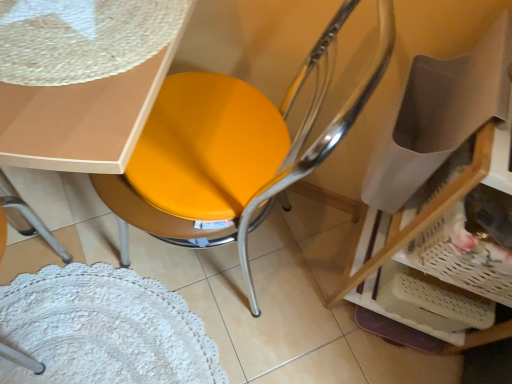
Question: Considering the relative positions of matte yellow seat at center and matte white table at upper left in the image provided, is matte yellow seat at center to the right of matte white table at upper left from the viewer's perspective?

Choices:
 (A) no
 (B) yes

Answer: (B)

Question: Is matte yellow seat at center not close to matte white table at upper left?

Choices:
 (A) no
 (B) yes

Answer: (A)

Question: Considering the relative sizes of matte yellow seat at center and matte white table at upper left in the image provided, is matte yellow seat at center shorter than matte white table at upper left?

Choices:
 (A) yes
 (B) no

Answer: (B)

Question: Is matte yellow seat at center completely or partially outside of matte white table at upper left?

Choices:
 (A) yes
 (B) no

Answer: (A)

Question: From a real-world perspective, is matte yellow seat at center under matte white table at upper left?

Choices:
 (A) no
 (B) yes

Answer: (B)

Question: From a real-world perspective, is matte yellow seat at center positioned above or below white woven basket at lower right?

Choices:
 (A) below
 (B) above

Answer: (A)

Question: Relative to white woven basket at lower right, is matte yellow seat at center in front or behind?

Choices:
 (A) behind
 (B) front

Answer: (B)

Question: Would you say matte yellow seat at center is inside or outside white woven basket at lower right?

Choices:
 (A) outside
 (B) inside

Answer: (A)

Question: Looking at their shapes, would you say matte yellow seat at center is wider or thinner than white woven basket at lower right?

Choices:
 (A) wide
 (B) thin

Answer: (A)

Question: Is white woven basket at lower right taller or shorter than matte yellow seat at center?

Choices:
 (A) short
 (B) tall

Answer: (A)

Question: From a real-world perspective, is white woven basket at lower right positioned above or below matte yellow seat at center?

Choices:
 (A) above
 (B) below

Answer: (A)

Question: Is white woven basket at lower right inside or outside of matte yellow seat at center?

Choices:
 (A) outside
 (B) inside

Answer: (A)

Question: Visually, is white woven basket at lower right positioned to the left or to the right of matte yellow seat at center?

Choices:
 (A) left
 (B) right

Answer: (B)

Question: Relative to matte white table at upper left, is matte yellow seat at center in front or behind?

Choices:
 (A) behind
 (B) front

Answer: (B)

Question: Is matte yellow seat at center situated inside matte white table at upper left or outside?

Choices:
 (A) outside
 (B) inside

Answer: (A)